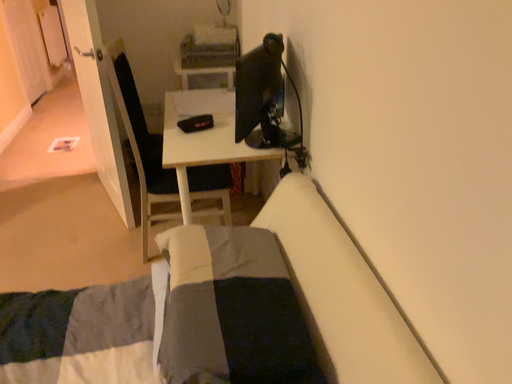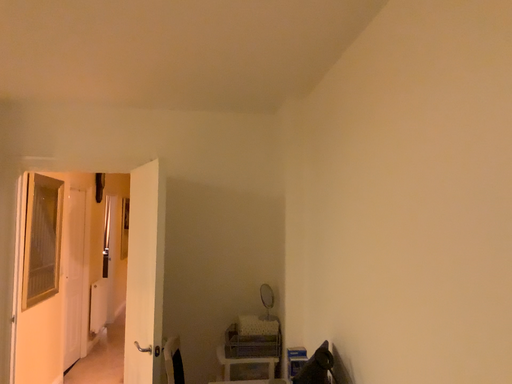
Question: How did the camera likely rotate when shooting the video?

Choices:
 (A) rotated downward
 (B) rotated upward

Answer: (B)